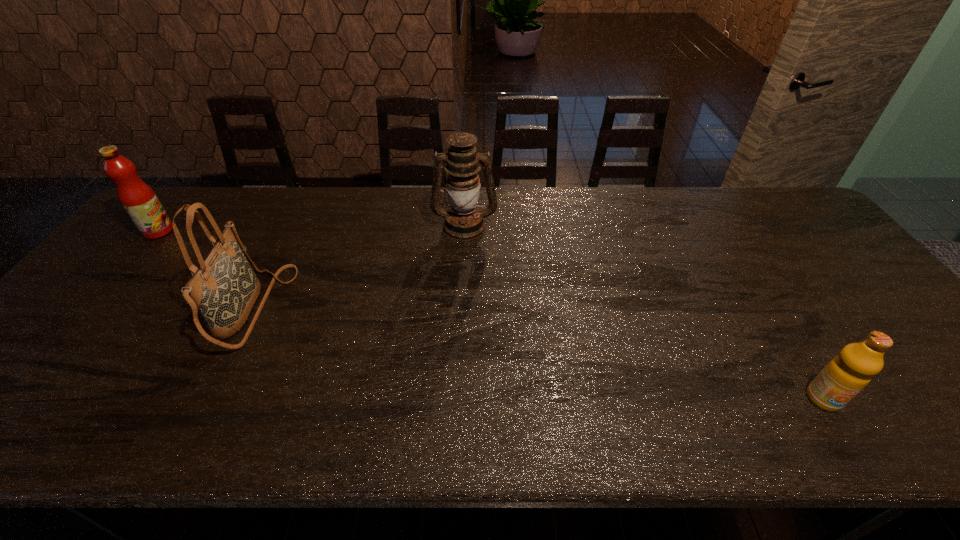
This screenshot has width=960, height=540. In order to click on free spot between the taller fruit juice and the rightmost object in this screenshot , I will do `click(491, 315)`.

Where is `vacant area that lies between the lantern and the second object from left to right`? This screenshot has width=960, height=540. vacant area that lies between the lantern and the second object from left to right is located at coordinates (359, 267).

Image resolution: width=960 pixels, height=540 pixels. In order to click on free space between the leftmost object and the nearer fruit juice in this screenshot , I will do `click(491, 315)`.

At what (x,y) coordinates should I click in order to perform the action: click on blank region between the shortest object and the left fruit juice. Please return your answer as a coordinate pair (x, y). Looking at the image, I should click on (491, 315).

The height and width of the screenshot is (540, 960). Identify the location of unoccupied area between the third object from left to right and the nearer fruit juice. (644, 312).

At what (x,y) coordinates should I click in order to perform the action: click on free area in between the rightmost object and the lantern. Please return your answer as a coordinate pair (x, y). The height and width of the screenshot is (540, 960). Looking at the image, I should click on (644, 312).

This screenshot has width=960, height=540. What are the coordinates of `the third closest object to the taller fruit juice` in the screenshot? It's located at pyautogui.click(x=847, y=374).

Identify the location of object that is the closest to the taller fruit juice. This screenshot has height=540, width=960. pyautogui.click(x=225, y=288).